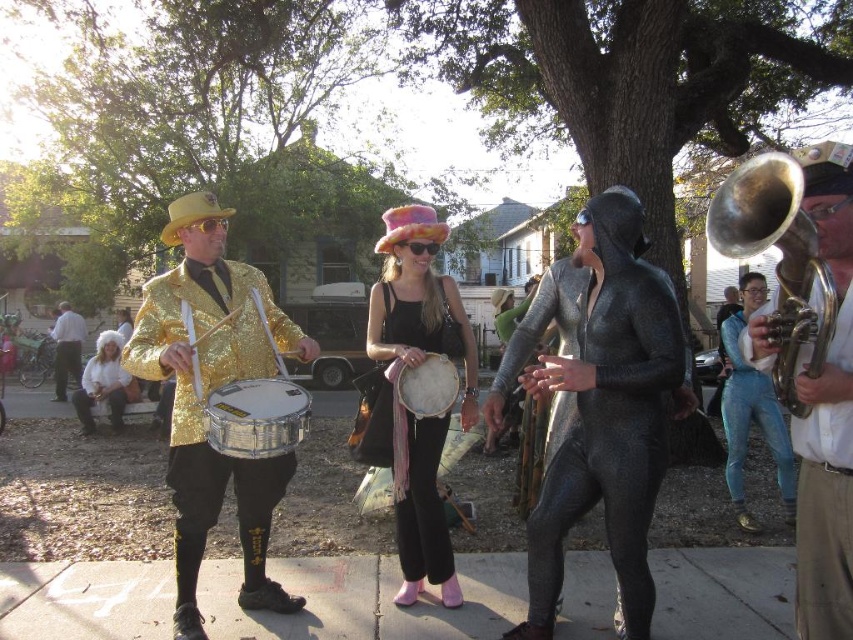
Identify the location of gold sequined jacket at left. (212, 388).

Is gold sequined jacket at left to the left of white metallic drum at center from the viewer's perspective?

Indeed, gold sequined jacket at left is positioned on the left side of white metallic drum at center.

Describe the element at coordinates (212, 388) in the screenshot. This screenshot has width=853, height=640. I see `gold sequined jacket at left` at that location.

Identify the location of gold sequined jacket at left. This screenshot has width=853, height=640. (212, 388).

Does point (819, 147) lie in front of point (107, 368)?

Yes, it is.

Is point (811, 634) positioned after point (115, 417)?

No.

Identify the location of shiny silver trumpet at right. (827, 412).

The image size is (853, 640). I want to click on shiny metallic suit at center, so click(x=606, y=408).

Is shiny metallic suit at center wider than white fabric drum at center?

Correct, the width of shiny metallic suit at center exceeds that of white fabric drum at center.

Locate an element on the screen. The image size is (853, 640). shiny metallic suit at center is located at coordinates (606, 408).

Identify the location of shiny metallic suit at center. The height and width of the screenshot is (640, 853). (606, 408).